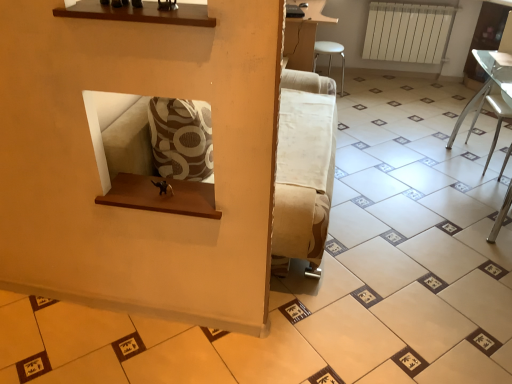
The width and height of the screenshot is (512, 384). What are the coordinates of `vacant area that lies between white plastic stool at upper right, which ranks as the first furniture in back-to-front order, and white fabric armchair at lower right` in the screenshot? It's located at (401, 125).